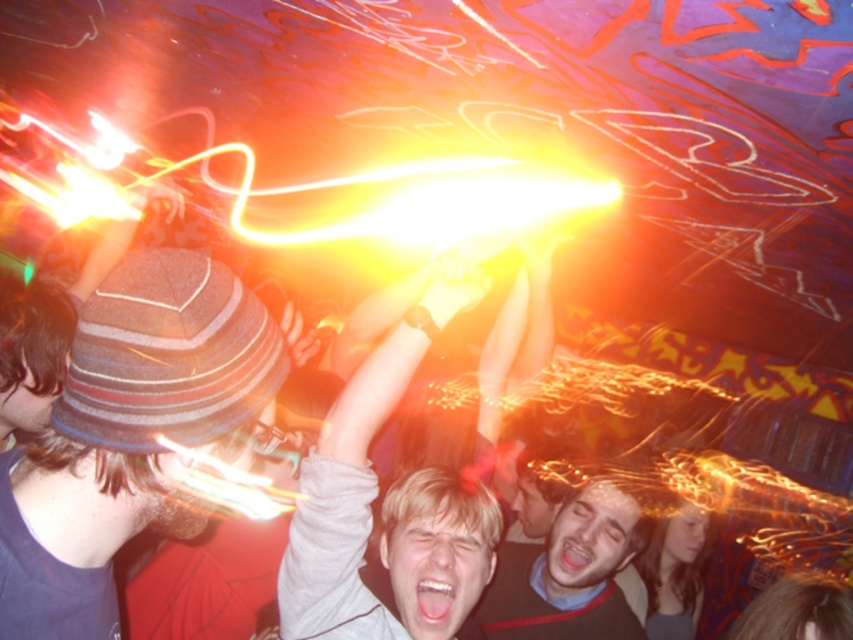
Who is positioned more to the left, striped wool hat at left or smooth gray shirt at center?

From the viewer's perspective, striped wool hat at left appears more on the left side.

Consider the image. Between striped wool hat at left and smooth gray shirt at center, which one is positioned lower?

smooth gray shirt at center is below.

Find the location of `striped wool hat at left`. striped wool hat at left is located at coordinates click(x=131, y=435).

Is smooth gray shirt at center above smooth black sweater at center?

Yes, smooth gray shirt at center is above smooth black sweater at center.

Between smooth gray shirt at center and smooth black sweater at center, which one is positioned lower?

Positioned lower is smooth black sweater at center.

Who is more distant from viewer, (463, 609) or (583, 509)?

Positioned behind is point (583, 509).

The width and height of the screenshot is (853, 640). What are the coordinates of `smooth gray shirt at center` in the screenshot? It's located at (343, 488).

Does striped wool hat at left have a lesser height compared to smooth black sweater at center?

Indeed, striped wool hat at left has a lesser height compared to smooth black sweater at center.

Between point (245, 339) and point (619, 636), which one is positioned in front?

Positioned in front is point (245, 339).

Where is `striped wool hat at left`? The image size is (853, 640). striped wool hat at left is located at coordinates (131, 435).